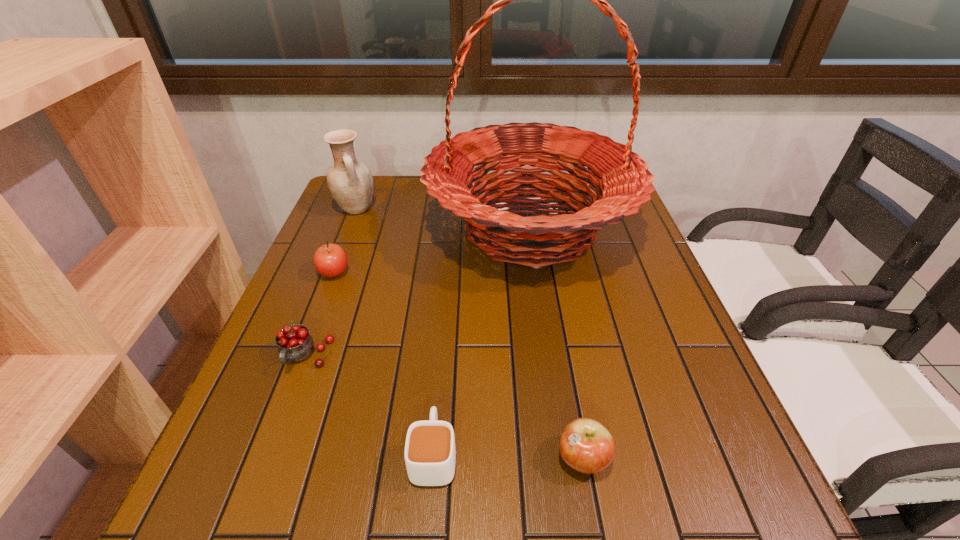
The height and width of the screenshot is (540, 960). I want to click on the closest object to the tallest object, so click(x=350, y=183).

Locate an element on the screen. This screenshot has width=960, height=540. the closest object relative to the second tallest object is located at coordinates point(621,178).

Identify the location of vacant area in the image that satisfies the following two spatial constraints: 1. on the handle side of the cherry; 2. on the left side of the nearer apple. (267, 458).